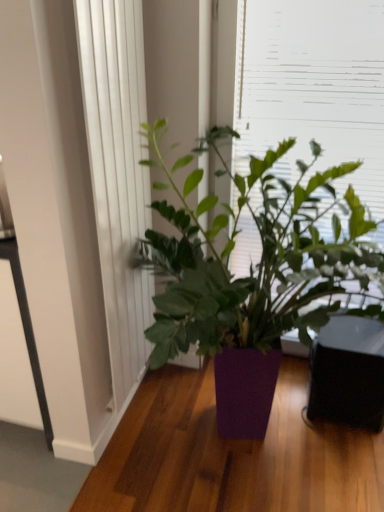
Identify the location of purple matte plant at center. (253, 275).

Describe the element at coordinates (118, 174) in the screenshot. The image size is (384, 512). I see `white textured curtain at left` at that location.

Identify the location of green leafy plant at upper center. Image resolution: width=384 pixels, height=512 pixels. (313, 88).

Find the location of a particular element. This screenshot has width=384, height=512. purple matte plant at center is located at coordinates (253, 275).

Is purple matte plant at center oriented towards green leafy plant at upper center?

No, purple matte plant at center is not facing towards green leafy plant at upper center.

Which of these two, purple matte plant at center or green leafy plant at upper center, is bigger?

purple matte plant at center is bigger.

Are purple matte plant at center and green leafy plant at upper center making contact?

No, purple matte plant at center is not next to green leafy plant at upper center.

Considering the positions of objects purple matte plant at center and green leafy plant at upper center in the image provided, who is behind, purple matte plant at center or green leafy plant at upper center?

green leafy plant at upper center.

Considering the relative sizes of purple matte plant at center and white textured curtain at left in the image provided, is purple matte plant at center bigger than white textured curtain at left?

Correct, purple matte plant at center is larger in size than white textured curtain at left.

Does point (191, 312) come in front of point (118, 410)?

That is True.

Is purple matte plant at center closer to the viewer compared to white textured curtain at left?

Yes, purple matte plant at center is closer to the camera.

From a real-world perspective, is white textured curtain at left positioned over green leafy plant at upper center based on gravity?

Actually, white textured curtain at left is physically below green leafy plant at upper center in the real world.

Is white textured curtain at left situated inside green leafy plant at upper center or outside?

The correct answer is: outside.

Could you tell me if white textured curtain at left is turned towards green leafy plant at upper center?

No, white textured curtain at left is not oriented towards green leafy plant at upper center.

Which is more to the left, white textured curtain at left or green leafy plant at upper center?

white textured curtain at left is more to the left.

Would you say green leafy plant at upper center is to the left or to the right of white textured curtain at left in the picture?

green leafy plant at upper center is to the right of white textured curtain at left.

Is green leafy plant at upper center completely or partially outside of white textured curtain at left?

Yes, green leafy plant at upper center is outside of white textured curtain at left.

Which is behind, green leafy plant at upper center or white textured curtain at left?

green leafy plant at upper center is behind.

The image size is (384, 512). Find the location of `houseplant below the white textured curtain at left (from a real-world perspective)`. houseplant below the white textured curtain at left (from a real-world perspective) is located at coordinates (253, 275).

Considering the positions of objects white textured curtain at left and purple matte plant at center in the image provided, who is behind, white textured curtain at left or purple matte plant at center?

white textured curtain at left is behind.

Is white textured curtain at left facing towards purple matte plant at center?

Yes, white textured curtain at left is turned towards purple matte plant at center.

From a real-world perspective, which is physically above, white textured curtain at left or purple matte plant at center?

In real-world perspective, white textured curtain at left is above.

Identify the location of houseplant beneath the green leafy plant at upper center (from a real-world perspective). The height and width of the screenshot is (512, 384). click(253, 275).

Between green leafy plant at upper center and purple matte plant at center, which one has larger size?

With larger size is purple matte plant at center.

Can you confirm if green leafy plant at upper center is thinner than purple matte plant at center?

Indeed, green leafy plant at upper center has a lesser width compared to purple matte plant at center.

In the image, is green leafy plant at upper center on the left side or the right side of purple matte plant at center?

green leafy plant at upper center is positioned on purple matte plant at center's right side.

The width and height of the screenshot is (384, 512). In order to click on houseplant located underneath the green leafy plant at upper center (from a real-world perspective) in this screenshot , I will do pos(253,275).

Find the location of a particular element. The image size is (384, 512). houseplant below the white textured curtain at left (from the image's perspective) is located at coordinates (253, 275).

Based on the photo, considering their positions, is white textured curtain at left positioned closer to purple matte plant at center than green leafy plant at upper center?

green leafy plant at upper center lies closer to purple matte plant at center than the other object.

When comparing their distances from green leafy plant at upper center, does white textured curtain at left or purple matte plant at center seem closer?

The object closer to green leafy plant at upper center is purple matte plant at center.

Consider the image. From the image, which object appears to be farther from green leafy plant at upper center, purple matte plant at center or white textured curtain at left?

white textured curtain at left is positioned further to the anchor green leafy plant at upper center.

When comparing their distances from white textured curtain at left, does green leafy plant at upper center or purple matte plant at center seem closer?

purple matte plant at center is positioned closer to the anchor white textured curtain at left.

Estimate the real-world distances between objects in this image. Which object is further from purple matte plant at center, green leafy plant at upper center or white textured curtain at left?

white textured curtain at left is further to purple matte plant at center.

Considering their positions, is purple matte plant at center positioned further to white textured curtain at left than green leafy plant at upper center?

green leafy plant at upper center lies further to white textured curtain at left than the other object.

The height and width of the screenshot is (512, 384). What are the coordinates of `houseplant between white textured curtain at left and green leafy plant at upper center from left to right` in the screenshot? It's located at (253, 275).